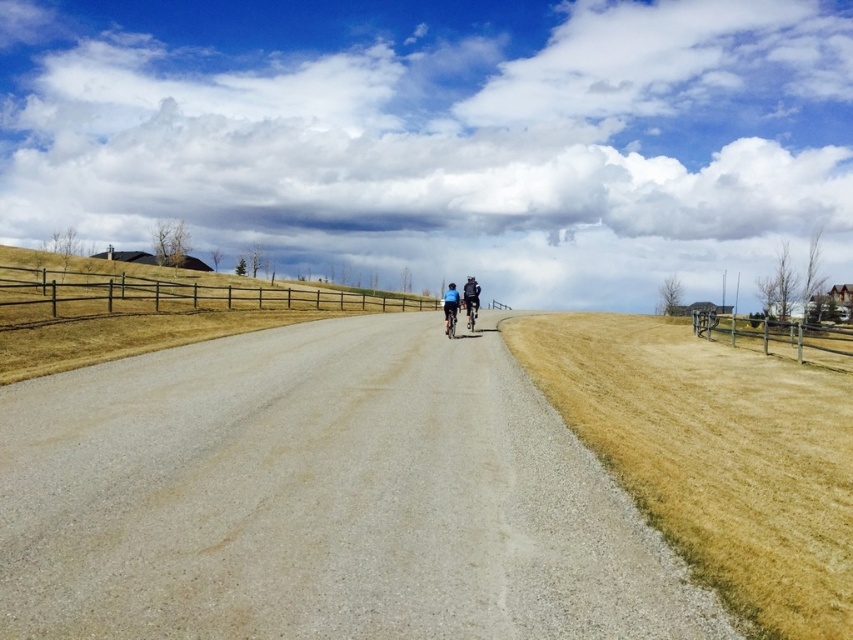
Is brown wooden fence at left to the left of shiny metallic bicycle at center from the viewer's perspective?

Correct, you'll find brown wooden fence at left to the left of shiny metallic bicycle at center.

Is brown wooden fence at left above shiny metallic bicycle at center?

Yes, brown wooden fence at left is above shiny metallic bicycle at center.

Does point (51, 317) lie behind point (474, 314)?

That is False.

Where is `brown wooden fence at left`? The width and height of the screenshot is (853, 640). brown wooden fence at left is located at coordinates (171, 296).

Between blue fabric bicycle at center and dark blue fabric jacket at center, which one appears on the left side from the viewer's perspective?

Positioned to the left is blue fabric bicycle at center.

Looking at this image, who is higher up, blue fabric bicycle at center or dark blue fabric jacket at center?

dark blue fabric jacket at center is above.

Does point (463, 292) come behind point (471, 321)?

No, (463, 292) is in front of (471, 321).

Identify the location of blue fabric bicycle at center. (460, 305).

Does brown wooden fence at left have a greater width compared to shiny blue bicycle at center?

Yes.

Does brown wooden fence at left appear under shiny blue bicycle at center?

No, brown wooden fence at left is not below shiny blue bicycle at center.

Between point (45, 305) and point (445, 308), which one is positioned in front?

Point (45, 305) is in front.

Identify the location of brown wooden fence at left. Image resolution: width=853 pixels, height=640 pixels. (171, 296).